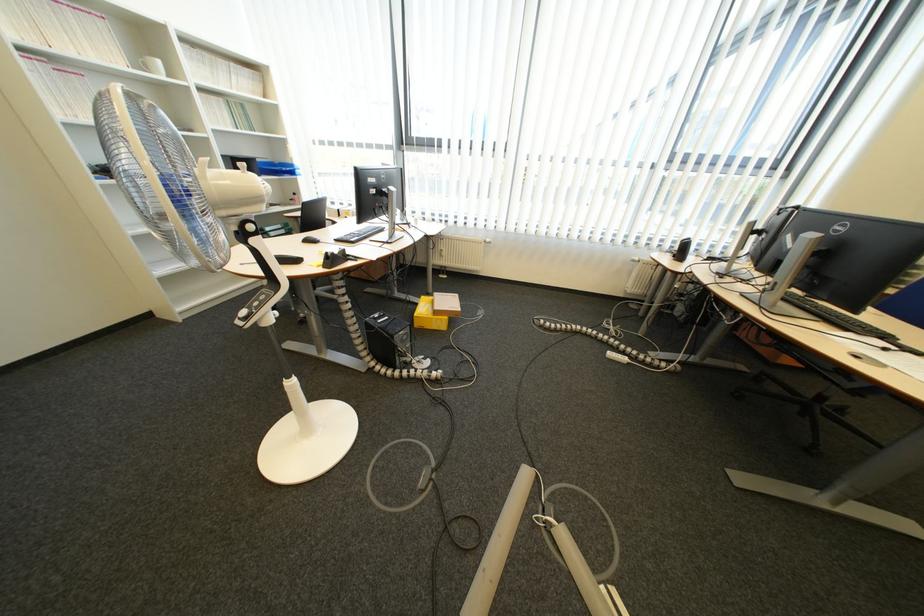
The width and height of the screenshot is (924, 616). What do you see at coordinates (618, 320) in the screenshot?
I see `the phone handset` at bounding box center [618, 320].